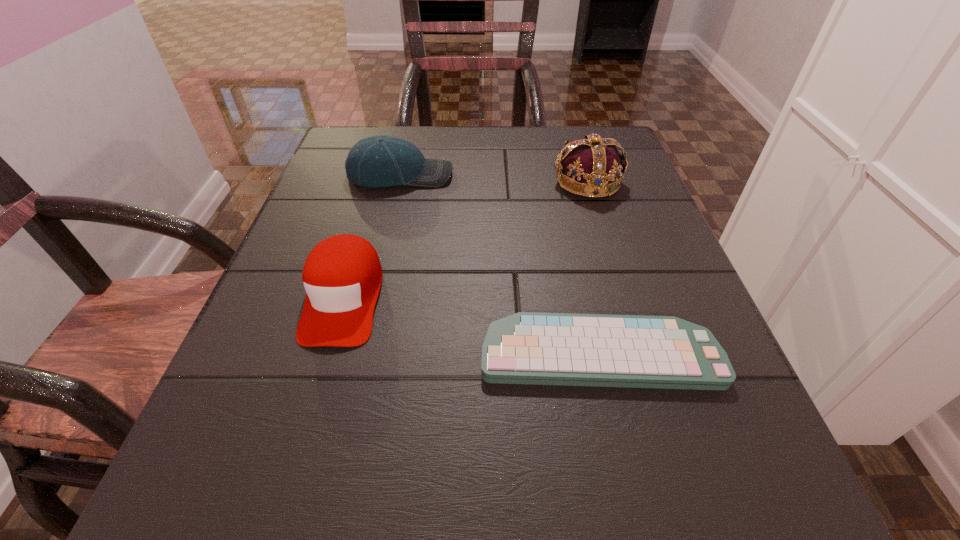
Locate an element on the screen. This screenshot has height=540, width=960. crown situated at the right edge is located at coordinates tap(593, 167).

Identify the location of computer keyboard present at the right edge. This screenshot has width=960, height=540. (636, 351).

Where is `object that is at the far left corner`? This screenshot has height=540, width=960. object that is at the far left corner is located at coordinates (379, 161).

Identify the location of object at the far right corner. (593, 167).

Identify the location of free location at the near edge. pos(587,510).

At what (x,y) coordinates should I click in order to perform the action: click on blank space at the left edge. Please return your answer as a coordinate pair (x, y). Looking at the image, I should click on (314, 370).

This screenshot has width=960, height=540. Find the location of `free space at the right edge of the desktop`. free space at the right edge of the desktop is located at coordinates (746, 444).

I want to click on free space at the near left corner of the desktop, so click(x=247, y=530).

The width and height of the screenshot is (960, 540). I want to click on free space between the nearer baseball cap and the computer keyboard, so click(471, 326).

Find the location of a particular element. The image size is (960, 540). empty space that is in between the tallest object and the nearer baseball cap is located at coordinates (466, 240).